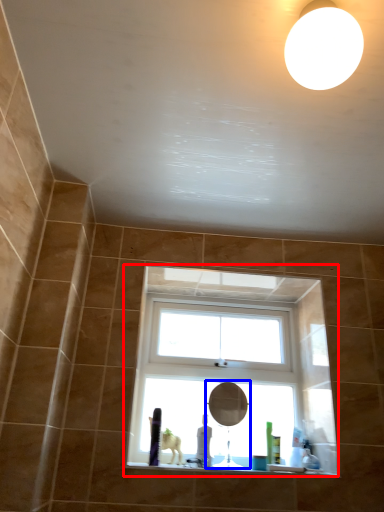
Question: Among these objects, which one is nearest to the camera, window (highlighted by a red box) or mirror (highlighted by a blue box)?

Choices:
 (A) window
 (B) mirror

Answer: (B)